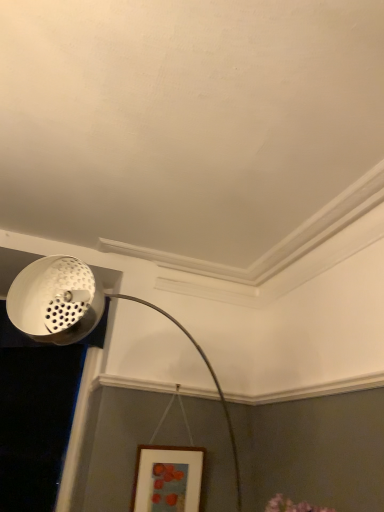
Question: Is white perforated lampshade at upper left completely or partially outside of wooden picture frame at lower center?

Choices:
 (A) yes
 (B) no

Answer: (A)

Question: Is white perforated lampshade at upper left bigger than wooden picture frame at lower center?

Choices:
 (A) no
 (B) yes

Answer: (B)

Question: Is white perforated lampshade at upper left positioned before wooden picture frame at lower center?

Choices:
 (A) no
 (B) yes

Answer: (B)

Question: Can you confirm if white perforated lampshade at upper left is positioned to the right of wooden picture frame at lower center?

Choices:
 (A) yes
 (B) no

Answer: (B)

Question: Is white perforated lampshade at upper left to the left of wooden picture frame at lower center from the viewer's perspective?

Choices:
 (A) yes
 (B) no

Answer: (A)

Question: Is white perforated lampshade at upper left taller than wooden picture frame at lower center?

Choices:
 (A) yes
 (B) no

Answer: (A)

Question: Is white perforated lampshade at upper left further to the viewer compared to white perforated metal at upper left?

Choices:
 (A) no
 (B) yes

Answer: (A)

Question: Is white perforated lampshade at upper left outside white perforated metal at upper left?

Choices:
 (A) yes
 (B) no

Answer: (A)

Question: Does white perforated lampshade at upper left come in front of white perforated metal at upper left?

Choices:
 (A) yes
 (B) no

Answer: (A)

Question: Is white perforated lampshade at upper left at the right side of white perforated metal at upper left?

Choices:
 (A) yes
 (B) no

Answer: (A)

Question: From the image's perspective, does white perforated lampshade at upper left appear higher than white perforated metal at upper left?

Choices:
 (A) no
 (B) yes

Answer: (A)

Question: From a real-world perspective, is white perforated lampshade at upper left on white perforated metal at upper left?

Choices:
 (A) yes
 (B) no

Answer: (B)

Question: Is there a large distance between white perforated metal at upper left and white perforated lampshade at upper left?

Choices:
 (A) yes
 (B) no

Answer: (B)